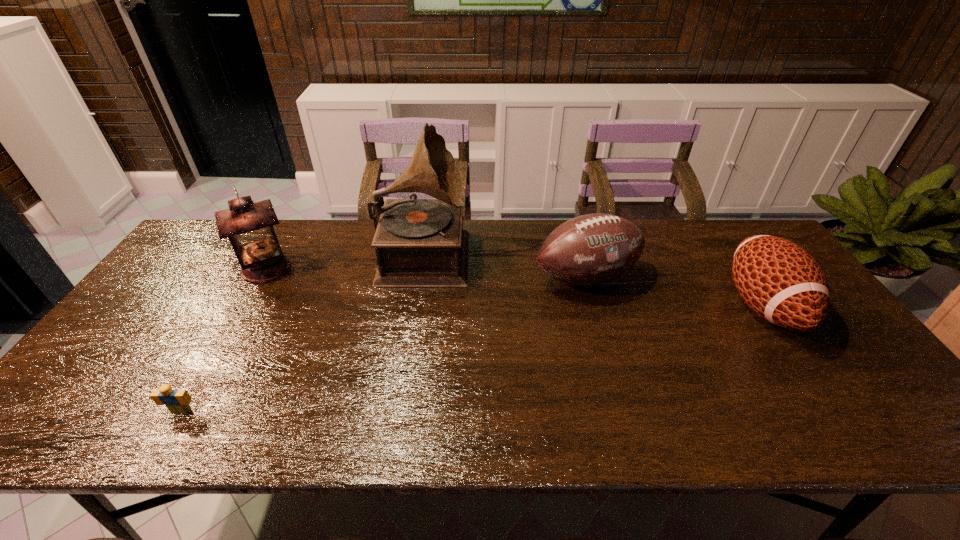
This screenshot has height=540, width=960. I want to click on vacant area that lies between the fourth object from left to right and the third object from right to left, so click(505, 265).

At what (x,y) coordinates should I click in order to perform the action: click on unoccupied area between the second object from right to left and the rightmost object. Please return your answer as a coordinate pair (x, y). The width and height of the screenshot is (960, 540). Looking at the image, I should click on (675, 292).

You are a GUI agent. You are given a task and a screenshot of the screen. Output one action in this format:
    pyautogui.click(x=<x>, y=<y>)
    Task: Click on the unoccupied position between the third object from left to right and the fourth object from left to right
    
    Given the screenshot: What is the action you would take?
    pyautogui.click(x=505, y=265)

You are a GUI agent. You are given a task and a screenshot of the screen. Output one action in this format:
    pyautogui.click(x=<x>, y=<y>)
    Task: Click on the free point between the third object from left to right and the nearest object
    
    Given the screenshot: What is the action you would take?
    pyautogui.click(x=302, y=332)

What are the coordinates of `vacant space that is in between the shortest object and the rightmost object` in the screenshot? It's located at (472, 358).

The width and height of the screenshot is (960, 540). I want to click on object that is the third nearest to the right football, so click(248, 225).

Find the location of `object that is the third closest to the rightmost object`. object that is the third closest to the rightmost object is located at coordinates 248,225.

Locate an element on the screen. This screenshot has height=540, width=960. vacant space that satisfies the following two spatial constraints: 1. from the horn of the record player; 2. on the face of the shortest object is located at coordinates (399, 411).

You are a GUI agent. You are given a task and a screenshot of the screen. Output one action in this format:
    pyautogui.click(x=<x>, y=<y>)
    Task: Click on the vacant region that satisfies the following two spatial constraints: 1. from the horn of the third object from right to left; 2. on the left side of the left football
    The image size is (960, 540).
    Given the screenshot: What is the action you would take?
    pyautogui.click(x=420, y=278)

Locate an element on the screen. free space that satisfies the following two spatial constraints: 1. on the front side of the right football; 2. on the left side of the left football is located at coordinates (593, 306).